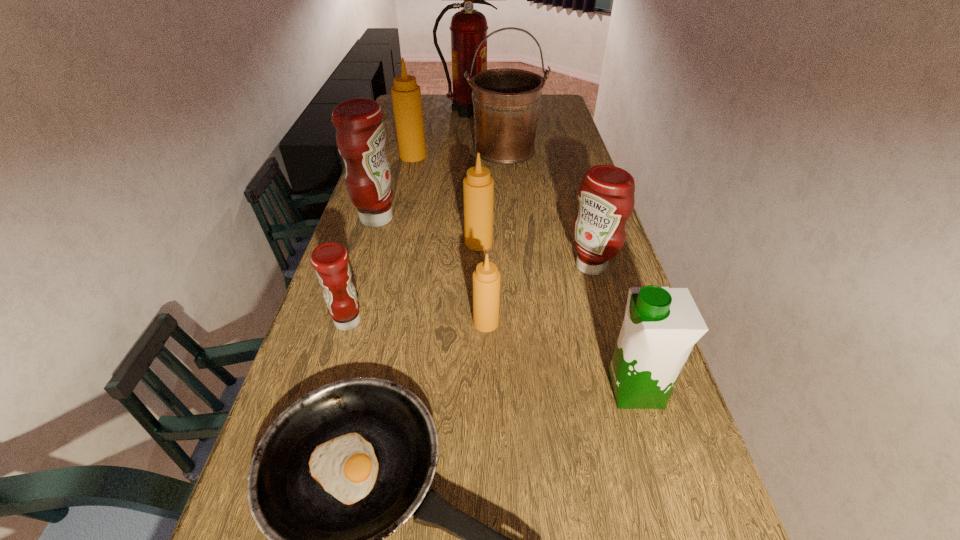
Identify which condiment is the closest to the fire extinguisher. Please provide its 2D coordinates. Your answer should be formatted as a tuple, i.e. [(x, y)], where the tuple contains the x and y coordinates of a point satisfying the conditions above.

[(406, 95)]

Where is `the closest tan condiment to the farthest condiment`? The image size is (960, 540). the closest tan condiment to the farthest condiment is located at coordinates (478, 186).

Locate which tan condiment is the closest to the leftmost tan condiment. Please provide its 2D coordinates. Your answer should be formatted as a tuple, i.e. [(x, y)], where the tuple contains the x and y coordinates of a point satisfying the conditions above.

[(478, 186)]

Identify which red condiment is the nearest to the red fire extinguisher. Please provide its 2D coordinates. Your answer should be formatted as a tuple, i.e. [(x, y)], where the tuple contains the x and y coordinates of a point satisfying the conditions above.

[(360, 134)]

At what (x,y) coordinates should I click in order to perform the action: click on the second closest red condiment relative to the rightmost condiment. Please return your answer as a coordinate pair (x, y). This screenshot has width=960, height=540. Looking at the image, I should click on (330, 260).

The width and height of the screenshot is (960, 540). In order to click on free location that satisfies the following two spatial constraints: 1. on the front side of the second nearest tan condiment; 2. on the left side of the nearest tan condiment in this screenshot , I will do `click(478, 323)`.

Identify the location of free spot that satisfies the following two spatial constraints: 1. on the back side of the nearest tan condiment; 2. on the front-facing side of the fire extinguisher. Image resolution: width=960 pixels, height=540 pixels. (483, 111).